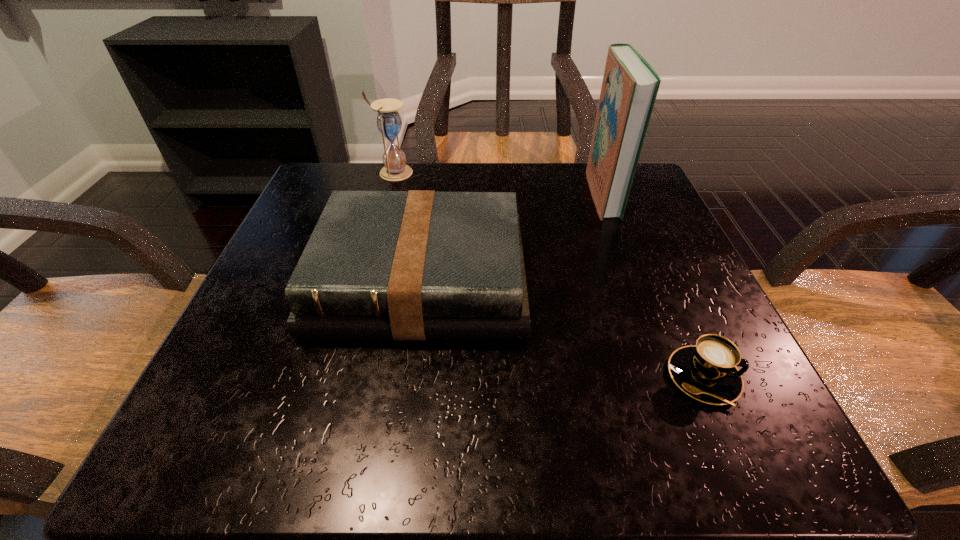
Identify the location of object located in the far left corner section of the desktop. (389, 123).

I want to click on object that is at the far right corner, so click(630, 85).

The height and width of the screenshot is (540, 960). Identify the location of object located in the near right corner section of the desktop. (707, 372).

I want to click on blank area at the far edge, so click(x=536, y=210).

In the image, there is a desktop. At what (x,y) coordinates should I click in order to perform the action: click on vacant space at the left edge. Please return your answer as a coordinate pair (x, y). The width and height of the screenshot is (960, 540). Looking at the image, I should click on (297, 245).

Locate an element on the screen. The height and width of the screenshot is (540, 960). vacant region at the right edge of the desktop is located at coordinates (642, 361).

This screenshot has height=540, width=960. I want to click on free region at the far left corner of the desktop, so click(347, 167).

Find the location of `free region at the near left corner of the desktop`. free region at the near left corner of the desktop is located at coordinates (224, 441).

Identify the location of free space at the far right corner of the desktop. This screenshot has height=540, width=960. point(659,223).

Locate an element on the screen. This screenshot has height=540, width=960. free spot at the near right corner of the desktop is located at coordinates (654, 409).